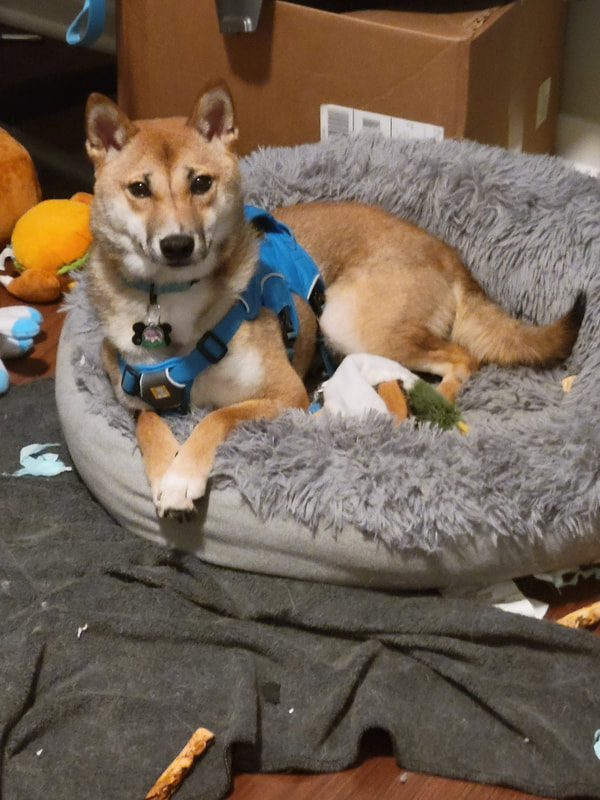
Identify the location of box. (151, 54).